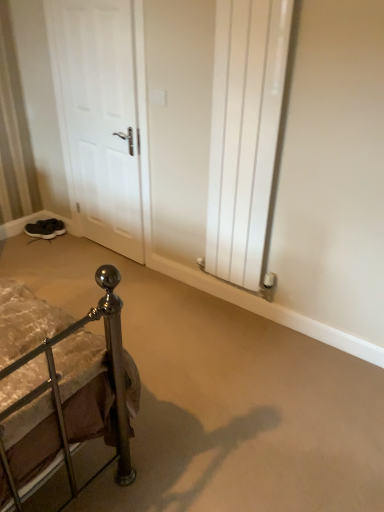
Identify the location of vacant space in front of black suede shoes at lower left, the 2th footwear in the front-to-back sequence. Image resolution: width=384 pixels, height=512 pixels. (52, 240).